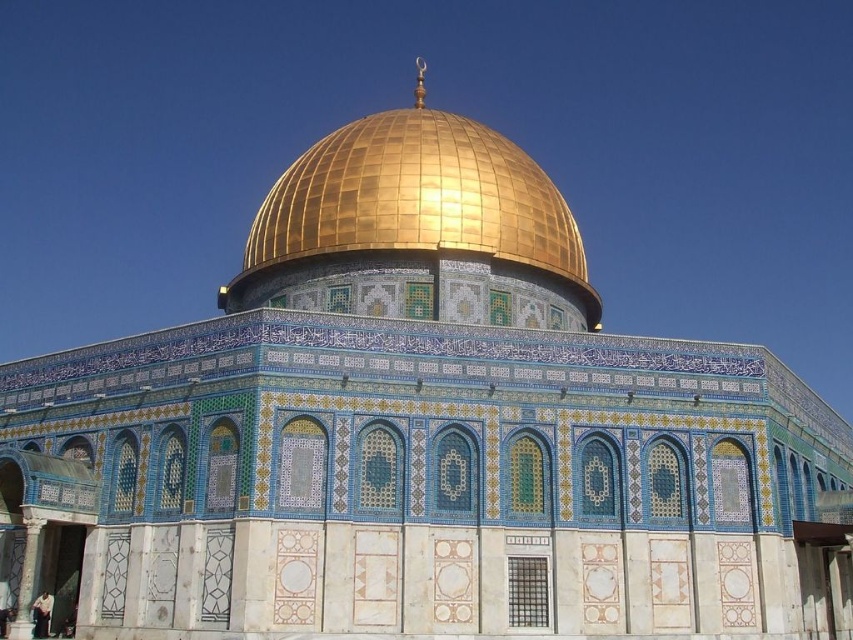
Which is below, gold mosaic dome at center or dark blue fabric at lower left?

Positioned lower is dark blue fabric at lower left.

Between gold mosaic dome at center and dark blue fabric at lower left, which one appears on the left side from the viewer's perspective?

Positioned to the left is dark blue fabric at lower left.

Is point (276, 205) less distant than point (42, 604)?

That is False.

Where is `gold mosaic dome at center`? gold mosaic dome at center is located at coordinates (416, 228).